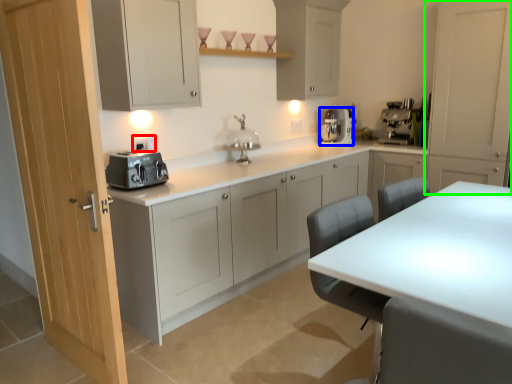
Question: Estimate the real-world distances between objects in this image. Which object is farther from electric outlet (highlighted by a red box), kitchen appliance (highlighted by a blue box) or cabinetry (highlighted by a green box)?

Choices:
 (A) kitchen appliance
 (B) cabinetry

Answer: (B)